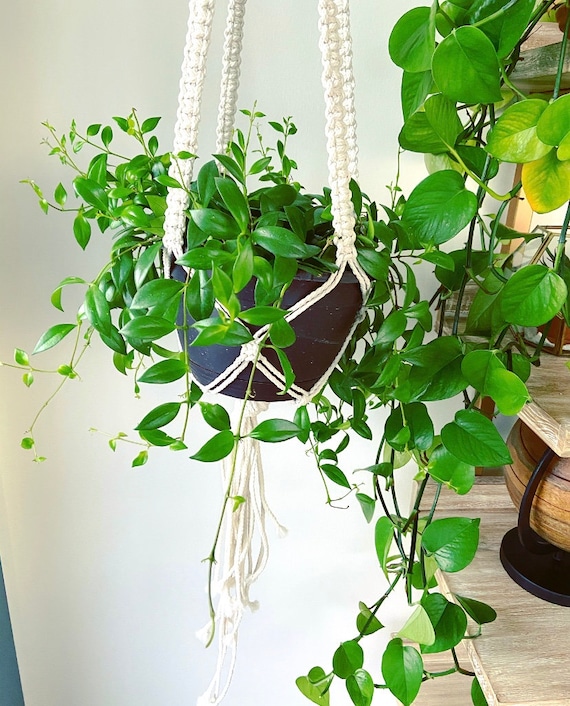
Locate an element on the screen. hanging flower pot is located at coordinates (308, 351).